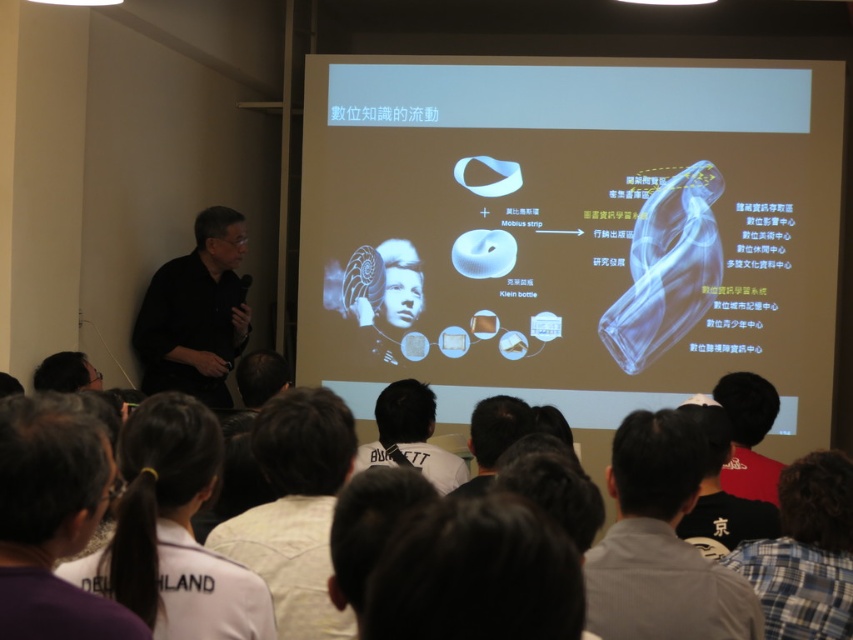
Question: Can you confirm if white shirt at lower center is bigger than white matte shirt at lower center?

Choices:
 (A) yes
 (B) no

Answer: (A)

Question: Estimate the real-world distances between objects in this image. Which object is closer to the white shirt at lower right?

Choices:
 (A) dark hair at center
 (B) transparent plastic klein bottle at upper center
 (C) white cotton shirt at lower center

Answer: (A)

Question: Does transparent plastic klein bottle at upper center have a smaller size compared to white shirt at lower center?

Choices:
 (A) no
 (B) yes

Answer: (A)

Question: Does dark hair at center have a greater width compared to white matte shirt at lower center?

Choices:
 (A) no
 (B) yes

Answer: (B)

Question: Which object is closer to the camera taking this photo?

Choices:
 (A) plaid shirt at lower right
 (B) white matte shirt at lower center
 (C) white shirt at lower right
 (D) black matte shirt at left

Answer: (C)

Question: Which object appears closest to the camera in this image?

Choices:
 (A) plaid shirt at lower right
 (B) transparent plastic klein bottle at upper center
 (C) dark hair at center
 (D) white fabric at lower left

Answer: (C)